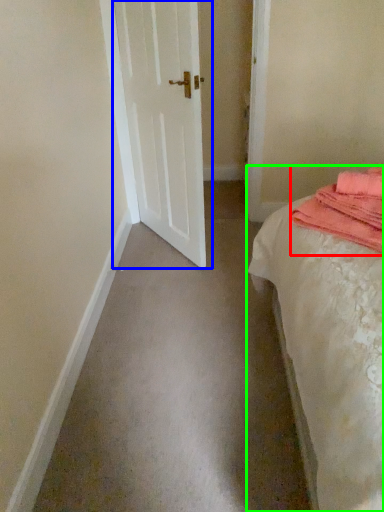
Question: Which is nearer to the material (highlighted by a red box)? door (highlighted by a blue box) or bed (highlighted by a green box).

Choices:
 (A) door
 (B) bed

Answer: (B)